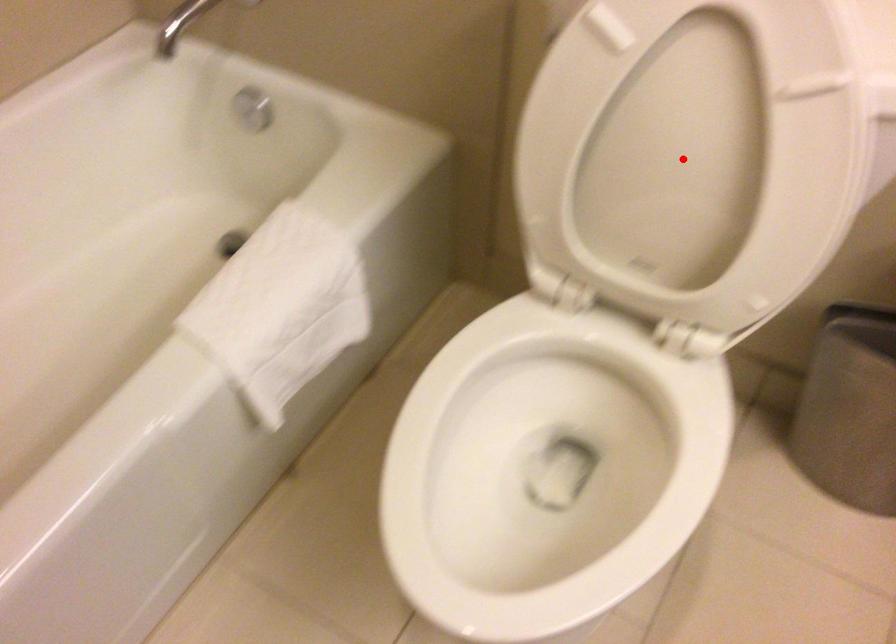
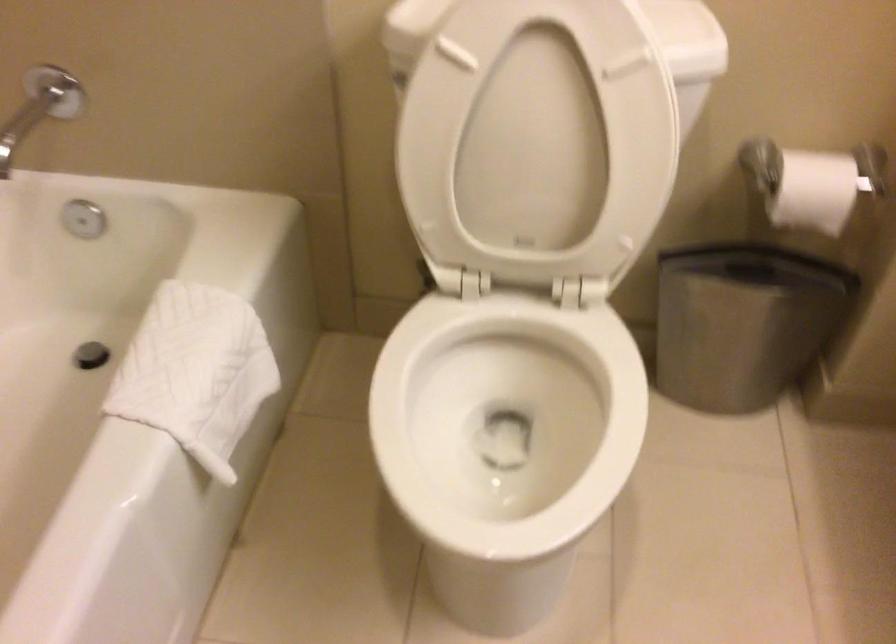
Question: I am providing you with two images of the same scene from different viewpoints. A red point is shown in image1. For the corresponding object point in image2, is it positioned nearer or farther from the camera?

Choices:
 (A) Nearer
 (B) Farther

Answer: (B)